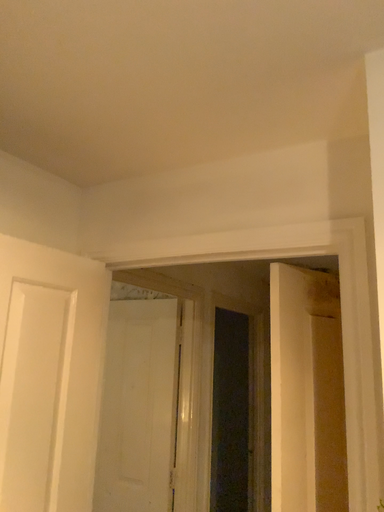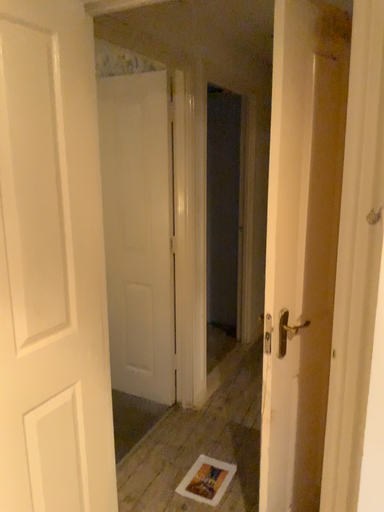
Question: How did the camera likely rotate when shooting the video?

Choices:
 (A) rotated downward
 (B) rotated upward

Answer: (A)